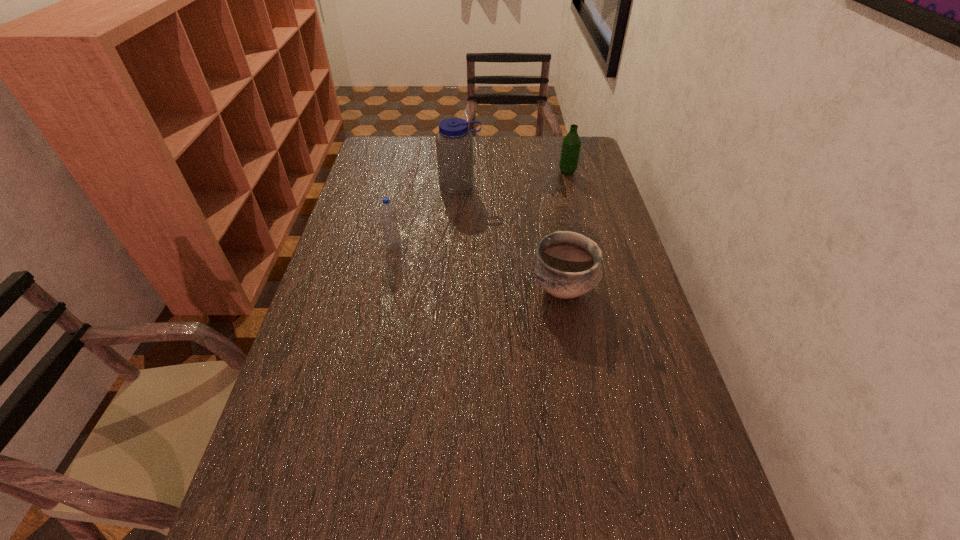
This screenshot has height=540, width=960. I want to click on object that can be found as the closest to the shortest object, so click(454, 143).

Locate an element on the screen. object that is the closest to the pottery is located at coordinates (454, 143).

Select which water bottle appears as the closest to the rightmost water bottle. Please provide its 2D coordinates. Your answer should be formatted as a tuple, i.e. [(x, y)], where the tuple contains the x and y coordinates of a point satisfying the conditions above.

[(454, 143)]

Identify which water bottle is the closest to the pottery. Please provide its 2D coordinates. Your answer should be formatted as a tuple, i.e. [(x, y)], where the tuple contains the x and y coordinates of a point satisfying the conditions above.

[(454, 143)]

Locate an element on the screen. The width and height of the screenshot is (960, 540). blank area in the image that satisfies the following two spatial constraints: 1. on the front side of the leftmost water bottle; 2. on the right side of the pottery is located at coordinates (385, 289).

Find the location of `free spot that satisfies the following two spatial constraints: 1. with a carrying loop on the side of the second water bottle from left to right; 2. on the right side of the nearest object`. free spot that satisfies the following two spatial constraints: 1. with a carrying loop on the side of the second water bottle from left to right; 2. on the right side of the nearest object is located at coordinates (454, 289).